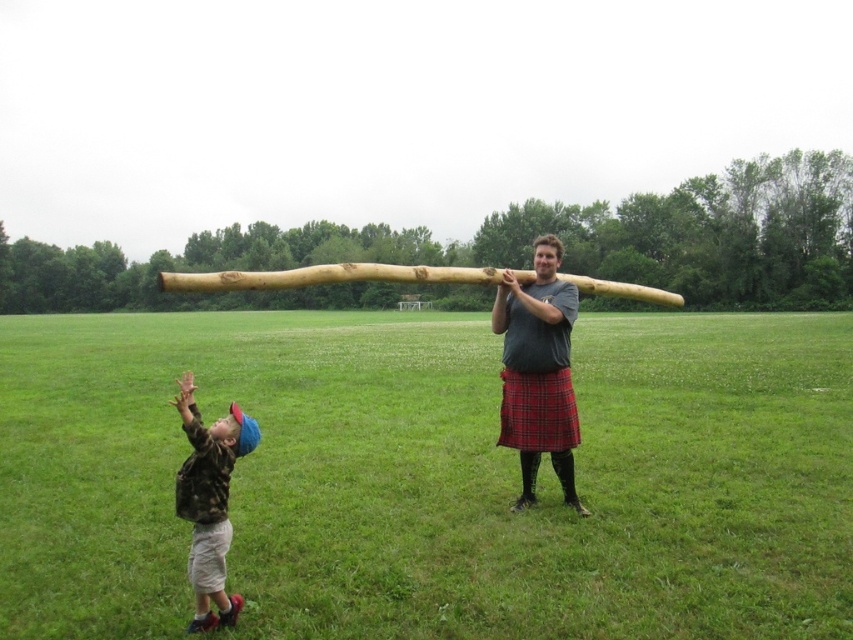
Does green grass at center appear over wooden log at center?

Correct, green grass at center is located above wooden log at center.

Locate an element on the screen. green grass at center is located at coordinates (430, 477).

Describe the element at coordinates (538, 371) in the screenshot. I see `wooden log at center` at that location.

Which is more to the right, wooden log at center or camouflage fabric shirt at lower left?

wooden log at center

Is point (503, 337) behind point (231, 529)?

That is True.

The height and width of the screenshot is (640, 853). I want to click on wooden log at center, so click(538, 371).

Does green grass at center appear under camouflage fabric shirt at lower left?

Actually, green grass at center is above camouflage fabric shirt at lower left.

From the picture: Does green grass at center come behind camouflage fabric shirt at lower left?

Yes, green grass at center is behind camouflage fabric shirt at lower left.

Who is more forward, (7, 380) or (215, 564)?

Positioned in front is point (215, 564).

Find the location of a particular element. green grass at center is located at coordinates (430, 477).